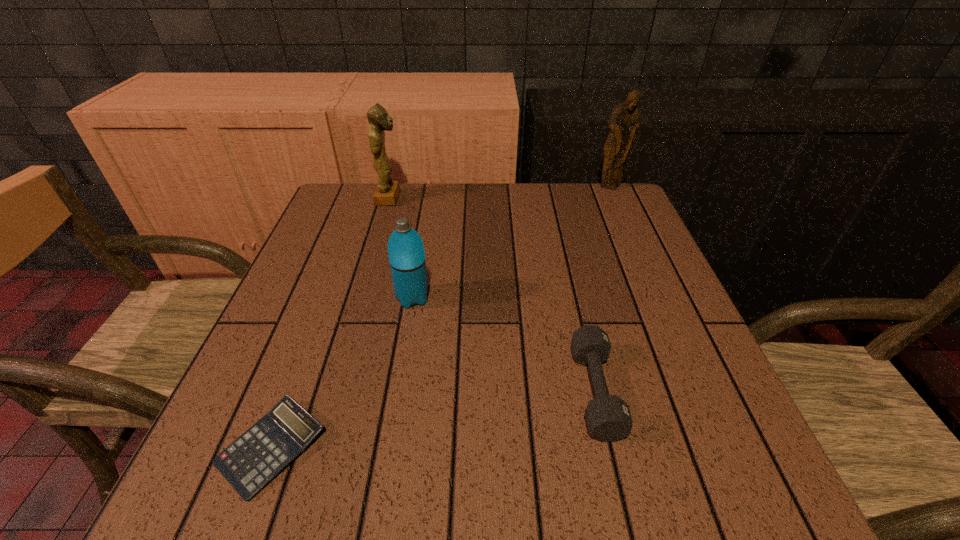
At what (x,y) coordinates should I click in order to perform the action: click on vacant space at the left edge of the desktop. Please return your answer as a coordinate pair (x, y). This screenshot has height=540, width=960. Looking at the image, I should click on (289, 309).

Where is `free space at the right edge of the desktop`? The width and height of the screenshot is (960, 540). free space at the right edge of the desktop is located at coordinates (678, 321).

Locate an element on the screen. vacant space at the far left corner of the desktop is located at coordinates (326, 204).

In the image, there is a desktop. Where is `vacant area at the far right corner`? The image size is (960, 540). vacant area at the far right corner is located at coordinates [596, 205].

The height and width of the screenshot is (540, 960). Find the location of `vacant space that is in between the third object from left to right and the dumbbell`. vacant space that is in between the third object from left to right and the dumbbell is located at coordinates (504, 344).

Where is `vacant space that is in between the calculator and the fourth object from left to right`? vacant space that is in between the calculator and the fourth object from left to right is located at coordinates (434, 419).

The image size is (960, 540). Identify the location of empty space that is in between the fourth object from left to right and the third shortest object. (504, 344).

Find the location of a particular element. The width and height of the screenshot is (960, 540). free point between the dumbbell and the rightmost object is located at coordinates (603, 289).

Locate an element on the screen. This screenshot has width=960, height=540. unoccupied area between the right figurine and the left figurine is located at coordinates (500, 193).

You are a GUI agent. You are given a task and a screenshot of the screen. Output one action in this format:
    pyautogui.click(x=<x>, y=<y>)
    Task: Click on the vacant space that is in between the left figurine and the rightmost object
    The width and height of the screenshot is (960, 540).
    Given the screenshot: What is the action you would take?
    pyautogui.click(x=500, y=193)